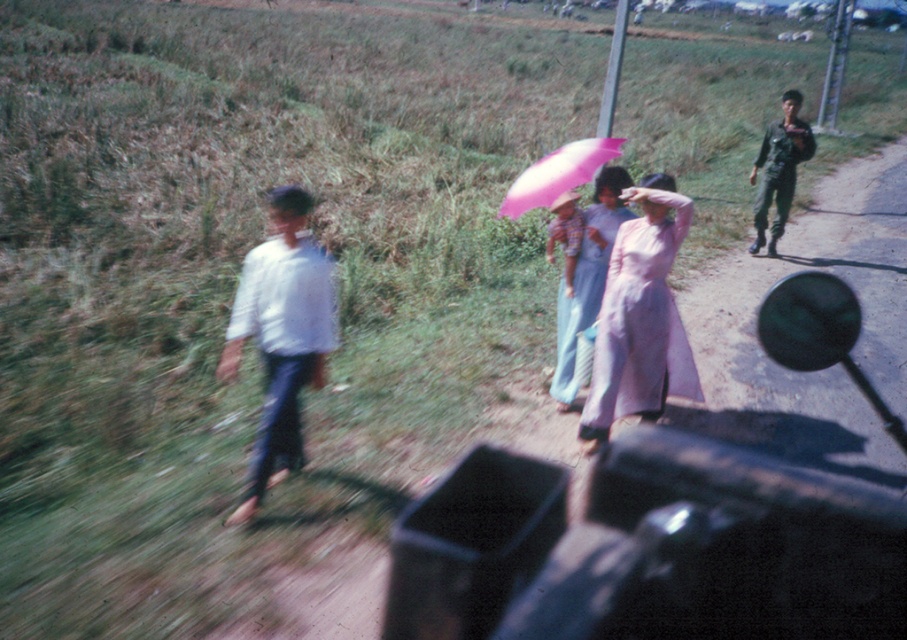
You are a photographer standing at the point closest to the camera. You want to take a photo of both the point at (564, 304) and the point at (615, 140). Which point should you focus on first to ensure both are in focus?

You should focus on the point at (564, 304) first because it is closer to you than the point at (615, 140). This way, the depth of field will cover both points effectively.

You are a photographer trying to capture a closeup shot of the pale pink silk ao dai at center and the dark green uniform at right. Which one will require you to zoom in more to fill the frame?

The pale pink silk ao dai at center is shorter than the dark green uniform at right, so you will need to zoom in more on the pale pink silk ao dai at center to fill the frame because it is closer to the camera than the dark green uniform at right.